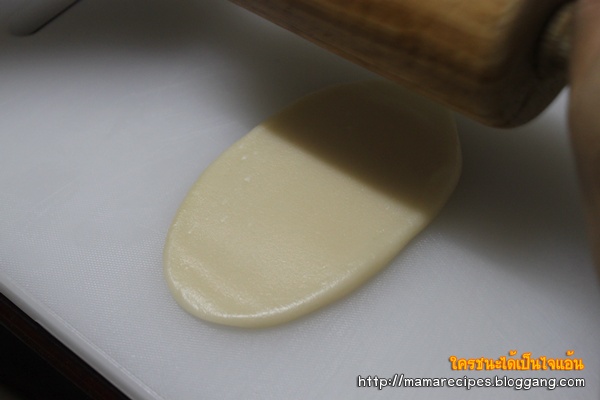
Locate an element on the screen. rolling pin is located at coordinates (462, 24).